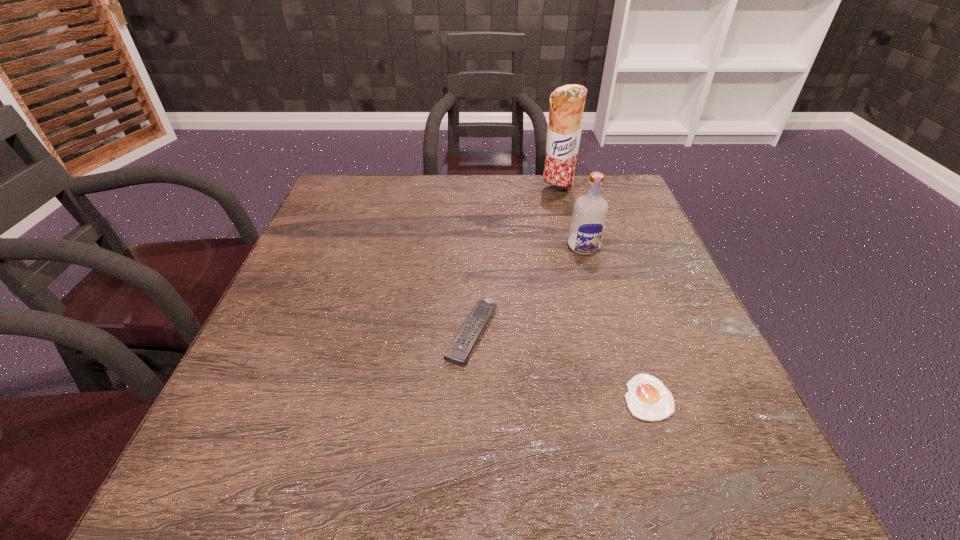
Locate an element on the screen. the farthest object is located at coordinates (567, 102).

The width and height of the screenshot is (960, 540). What are the coordinates of `the tallest object` in the screenshot? It's located at (567, 102).

The height and width of the screenshot is (540, 960). Identify the location of vodka. (589, 215).

Find the location of a particular element. The image size is (960, 540). the second tallest object is located at coordinates (589, 215).

I want to click on the leftmost object, so click(x=461, y=347).

You are a GUI agent. You are given a task and a screenshot of the screen. Output one action in this format:
    pyautogui.click(x=<x>, y=<y>)
    Task: Click on the remote control
    
    Given the screenshot: What is the action you would take?
    pyautogui.click(x=461, y=347)

Locate an element on the screen. This screenshot has height=540, width=960. the shortest object is located at coordinates (648, 399).

The height and width of the screenshot is (540, 960). In order to click on the nearest object in this screenshot , I will do `click(648, 399)`.

Image resolution: width=960 pixels, height=540 pixels. Find the location of `free location located on the left of the burrito`. free location located on the left of the burrito is located at coordinates click(x=421, y=191).

Where is `vacant position located on the label of the vodka`? This screenshot has height=540, width=960. vacant position located on the label of the vodka is located at coordinates (604, 315).